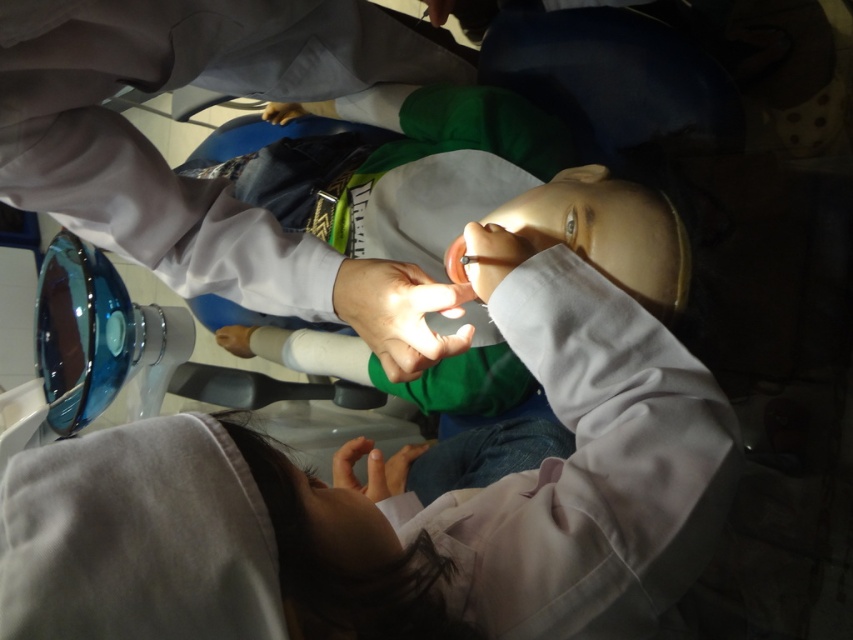
Question: Which of the following is the closest to the observer?

Choices:
 (A) matte black glove at upper center
 (B) smooth skin hand at center

Answer: (B)

Question: Is matte white hand at center smaller than matte black glove at upper center?

Choices:
 (A) yes
 (B) no

Answer: (A)

Question: Does matte white hand at center have a lesser width compared to matte black glove at upper center?

Choices:
 (A) yes
 (B) no

Answer: (A)

Question: Which point appears closest to the camera in this image?

Choices:
 (A) (293, 115)
 (B) (363, 273)
 (C) (224, 326)

Answer: (B)

Question: From the image, what is the correct spatial relationship of smooth skin hand at center in relation to matte white hand at center?

Choices:
 (A) below
 (B) above

Answer: (B)

Question: Which object is positioned farthest from the matte black glove at upper center?

Choices:
 (A) smooth skin hand at center
 (B) matte white hand at center

Answer: (A)